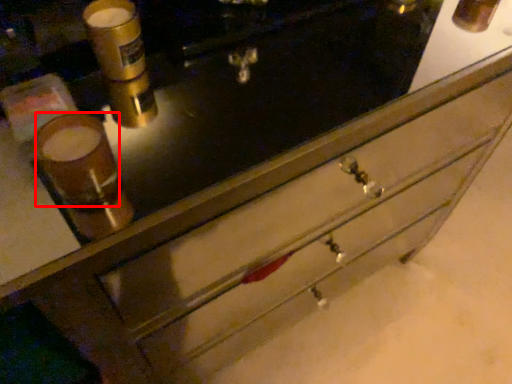
Question: From the image's perspective, where is beverage (annotated by the red box) located relative to beverage?

Choices:
 (A) above
 (B) below

Answer: (B)